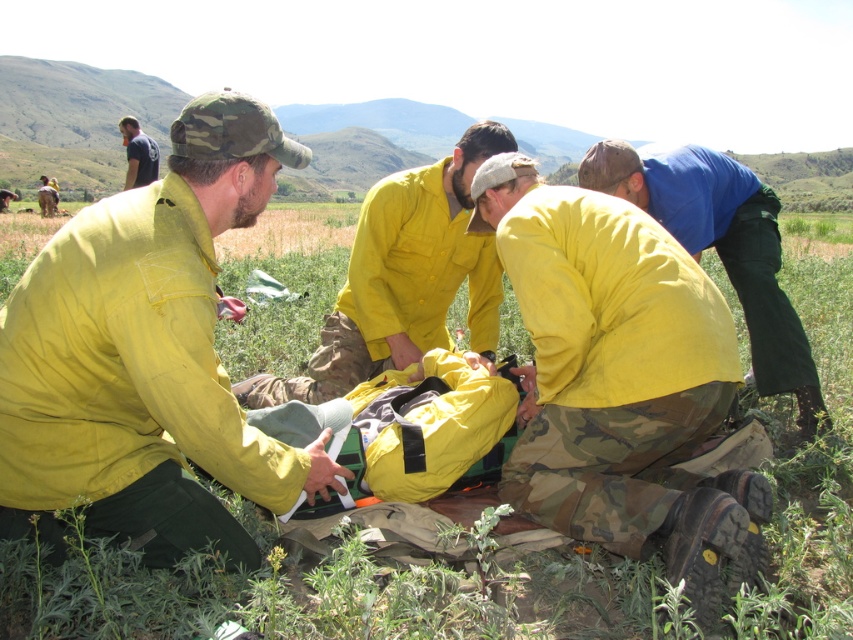
Looking at this image, you are a safety inspector reviewing the scene. You notice two clothing items in the image, the matte yellow jacket at left and the blue cotton shirt at upper right. Which clothing item has a narrower width?

The matte yellow jacket at left is thinner than the blue cotton shirt at upper right, so the matte yellow jacket at left has a narrower width.

You are a drone operator controlling a drone that needs to hover exactly 2 meters above the point at coordinates point (683, 356). Given that the drone is currently at the viewer position, can you confirm if the distance between the drone and the point is sufficient to allow the drone to ascend vertically to the required altitude without any obstacles?

The distance between the point (683, 356) and the viewer is 1.96 meters. Since the drone needs to ascend 2 meters vertically, it is slightly closer than required. The drone would need to move forward an additional 0.04 meters to ensure it can reach the 2 meter altitude safely without obstacles.

You are a drone operator trying to locate the matte yellow jacket at left in the scene. Based on the coordinates provided, where should you direct the drone to look?

→ The matte yellow jacket at left is located at coordinates point (149,356).